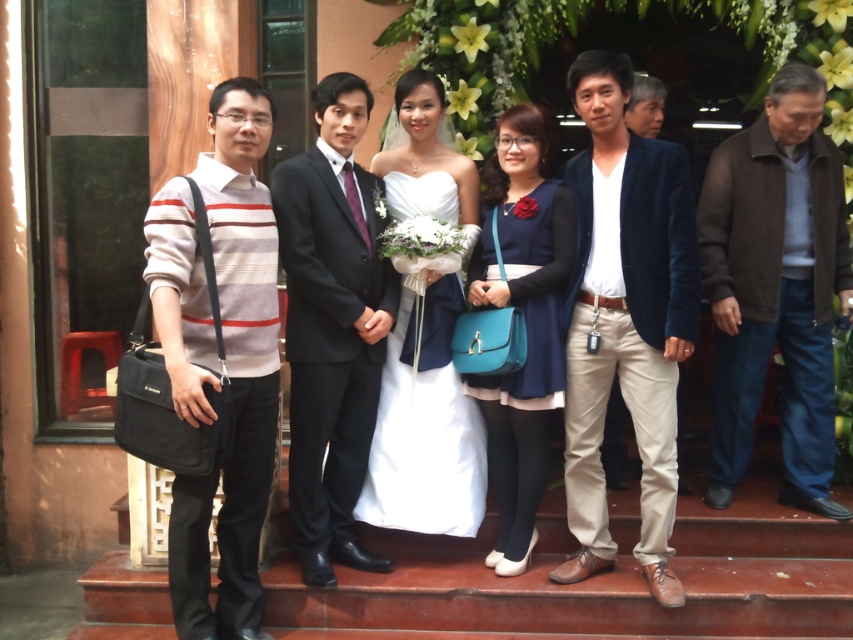
Is velvet blue blazer at center thinner than brown woolen jacket at right?

Yes, velvet blue blazer at center is thinner than brown woolen jacket at right.

Does velvet blue blazer at center appear under brown woolen jacket at right?

Yes, velvet blue blazer at center is below brown woolen jacket at right.

Between point (647, 209) and point (718, 330), which one is positioned in front?

Point (647, 209) is in front.

This screenshot has width=853, height=640. What are the coordinates of `velvet blue blazer at center` in the screenshot? It's located at (625, 317).

Between point (236, 148) and point (310, 220), which one is positioned behind?

Point (310, 220)

Is striped sweater at left positioned at the back of black satin suit at center?

No, striped sweater at left is in front of black satin suit at center.

Who is more forward, (260, 106) or (339, 253)?

Point (260, 106) is more forward.

Identify the location of striped sweater at left. This screenshot has height=640, width=853. (233, 376).

Can you confirm if brown woolen jacket at right is thinner than black satin suit at center?

Incorrect, brown woolen jacket at right's width is not less than black satin suit at center's.

Does brown woolen jacket at right have a lesser height compared to black satin suit at center?

Yes.

This screenshot has height=640, width=853. What do you see at coordinates (775, 285) in the screenshot?
I see `brown woolen jacket at right` at bounding box center [775, 285].

At what (x,y) coordinates should I click in order to perform the action: click on brown woolen jacket at right. Please return your answer as a coordinate pair (x, y). The height and width of the screenshot is (640, 853). Looking at the image, I should click on (775, 285).